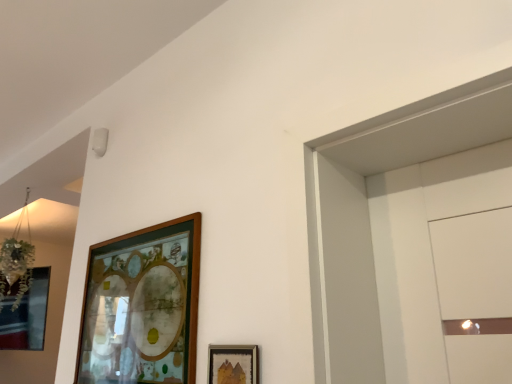
Question: Would you say wooden picture frame at upper center, which is counted as the second picture frame, starting from the front, is inside or outside wooden frame at lower center, positioned as the second picture frame in left-to-right order?

Choices:
 (A) inside
 (B) outside

Answer: (B)

Question: From the image's perspective, is wooden picture frame at upper center, placed as the second picture frame when sorted from right to left, above or below wooden frame at lower center, which is the 1th picture frame in front-to-back order?

Choices:
 (A) above
 (B) below

Answer: (A)

Question: Would you say wooden picture frame at upper center, placed as the second picture frame when sorted from right to left, is to the left or to the right of wooden frame at lower center, positioned as the first picture frame in right-to-left order, in the picture?

Choices:
 (A) left
 (B) right

Answer: (A)

Question: From a real-world perspective, is wooden frame at lower center, positioned as the second picture frame in left-to-right order, positioned above or below wooden picture frame at upper center, marked as the first picture frame in a back-to-front arrangement?

Choices:
 (A) below
 (B) above

Answer: (A)

Question: Is point (208, 355) closer or farther from the camera than point (148, 243)?

Choices:
 (A) farther
 (B) closer

Answer: (B)

Question: From the image's perspective, is wooden frame at lower center, positioned as the first picture frame in right-to-left order, above or below wooden picture frame at upper center, placed as the second picture frame when sorted from right to left?

Choices:
 (A) above
 (B) below

Answer: (B)

Question: In terms of width, does wooden frame at lower center, positioned as the first picture frame in right-to-left order, look wider or thinner when compared to wooden picture frame at upper center, placed as the second picture frame when sorted from right to left?

Choices:
 (A) thin
 (B) wide

Answer: (A)